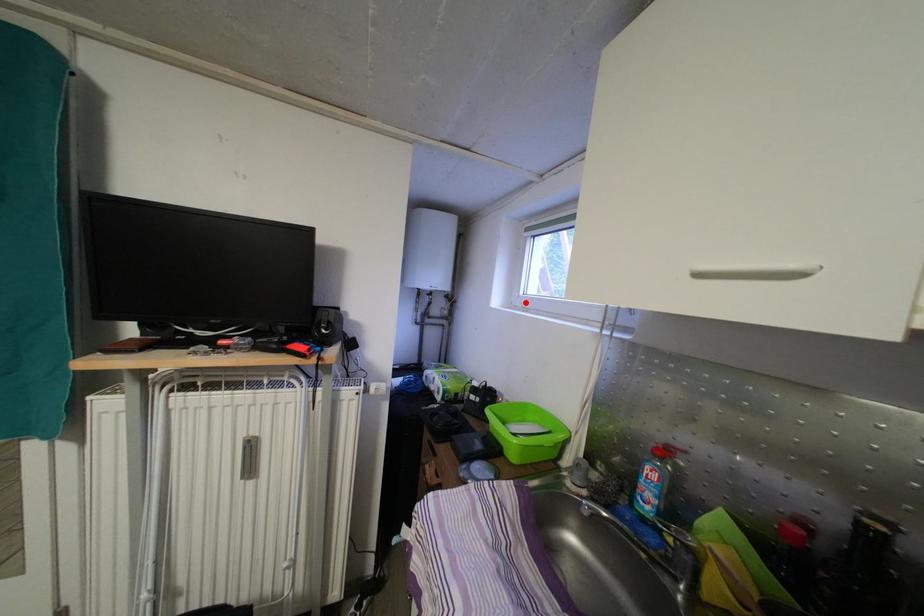
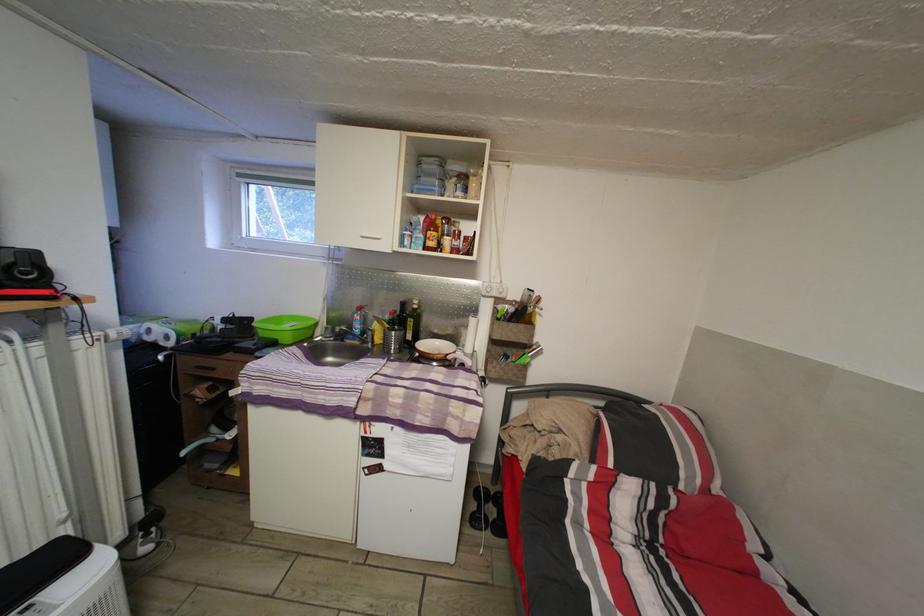
The point at the highlighted location is marked in the first image. Where is the corresponding point in the second image?

(249, 244)